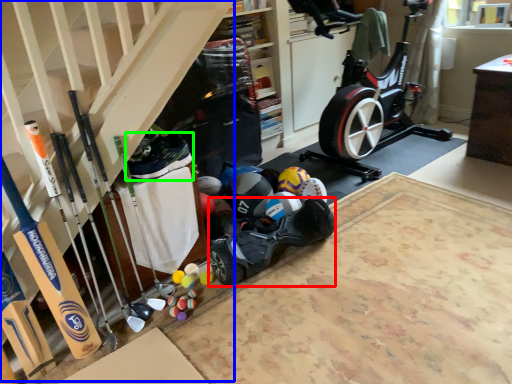
Question: Considering the real-world distances, which object is closest to car (highlighted by a red box)? stairs (highlighted by a blue box) or shoe (highlighted by a green box).

Choices:
 (A) stairs
 (B) shoe

Answer: (B)